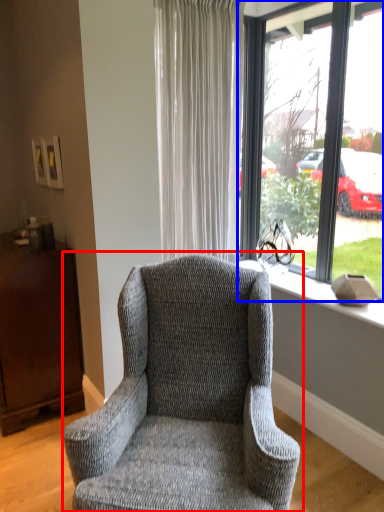
Question: Among these objects, which one is nearest to the camera, chair (highlighted by a red box) or window (highlighted by a blue box)?

Choices:
 (A) chair
 (B) window

Answer: (A)